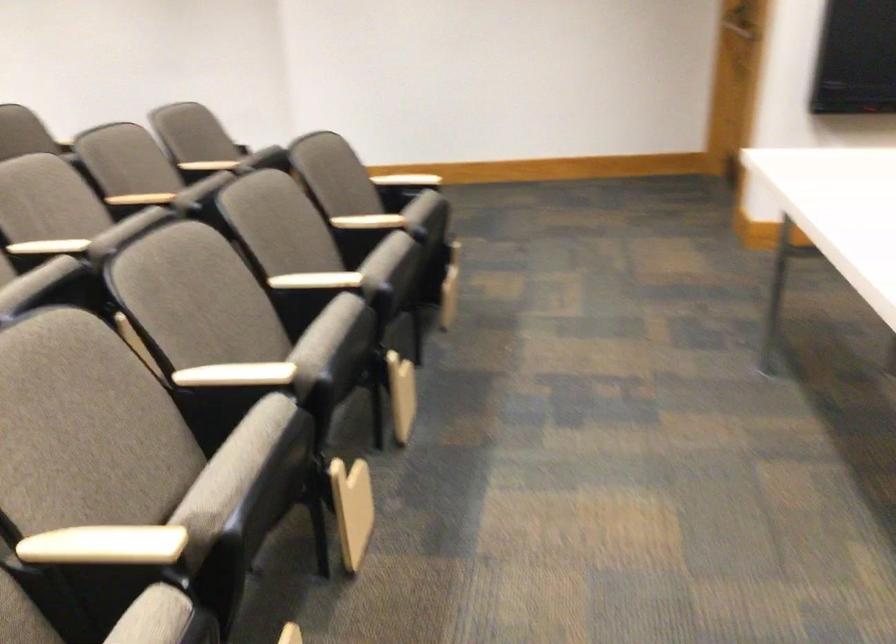
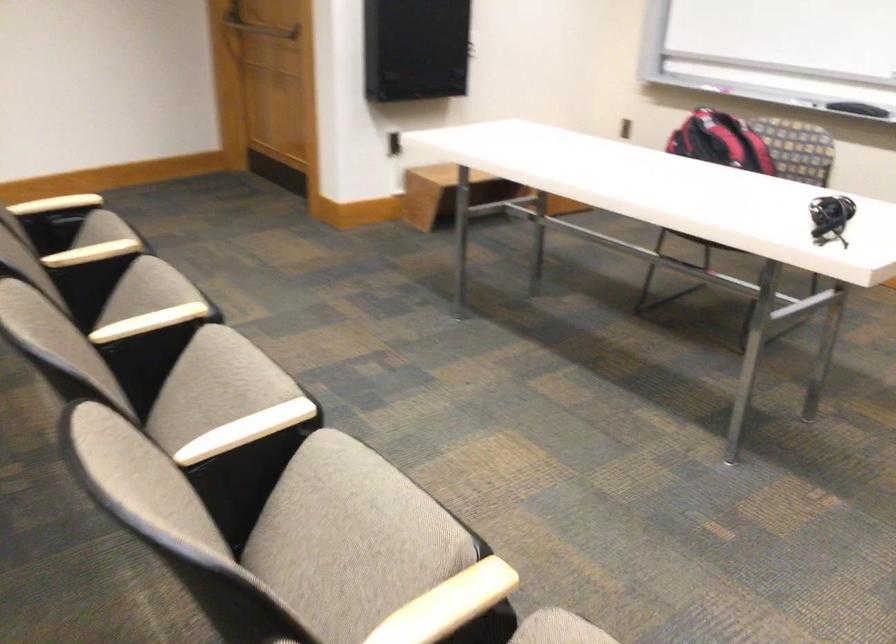
The point at (235, 373) is marked in the first image. Where is the corresponding point in the second image?

(245, 430)